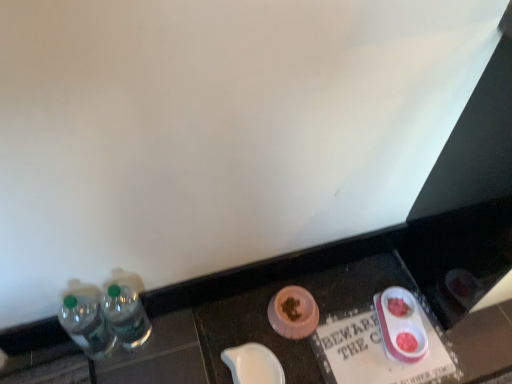
Question: Could you tell me if clear plastic bottles at left, the 2th bottle viewed from the left, is turned towards clear plastic bottles at left?

Choices:
 (A) no
 (B) yes

Answer: (A)

Question: Can you confirm if clear plastic bottles at left, which is counted as the first bottle, starting from the right, is taller than clear plastic bottles at left?

Choices:
 (A) yes
 (B) no

Answer: (A)

Question: Considering the relative sizes of clear plastic bottles at left, the 2th bottle viewed from the left, and clear plastic bottles at left in the image provided, is clear plastic bottles at left, the 2th bottle viewed from the left, wider than clear plastic bottles at left?

Choices:
 (A) yes
 (B) no

Answer: (A)

Question: Are clear plastic bottles at left, which is counted as the first bottle, starting from the right, and clear plastic bottles at left far apart?

Choices:
 (A) yes
 (B) no

Answer: (B)

Question: Is clear plastic bottles at left, the 2th bottle viewed from the left, smaller than clear plastic bottles at left?

Choices:
 (A) no
 (B) yes

Answer: (B)

Question: Which is correct: white paper sign at lower center is inside clear plastic bottles at left, or outside of it?

Choices:
 (A) inside
 (B) outside

Answer: (B)

Question: From a real-world perspective, is white paper sign at lower center positioned above or below clear plastic bottles at left?

Choices:
 (A) below
 (B) above

Answer: (A)

Question: Is point (373, 317) positioned closer to the camera than point (242, 339)?

Choices:
 (A) farther
 (B) closer

Answer: (A)

Question: Based on their positions, is white paper sign at lower center located to the left or right of clear plastic bottles at left?

Choices:
 (A) left
 (B) right

Answer: (B)

Question: Does point (333, 329) appear closer or farther from the camera than point (402, 309)?

Choices:
 (A) farther
 (B) closer

Answer: (B)

Question: Looking at the image, does white paper sign at lower center seem bigger or smaller compared to pink plastic food bowls at lower right, placed as the second tableware when sorted from left to right?

Choices:
 (A) small
 (B) big

Answer: (B)

Question: Is white paper sign at lower center wider or thinner than pink plastic food bowls at lower right, placed as the second tableware when sorted from left to right?

Choices:
 (A) thin
 (B) wide

Answer: (B)

Question: Considering their positions, is white paper sign at lower center located in front of or behind pink plastic food bowls at lower right, placed as the second tableware when sorted from left to right?

Choices:
 (A) behind
 (B) front

Answer: (B)

Question: Is clear plastic bottles at left, the 2th bottle viewed from the left, spatially inside white paper sign at lower center, or outside of it?

Choices:
 (A) inside
 (B) outside

Answer: (B)

Question: Considering the positions of clear plastic bottles at left, which is counted as the first bottle, starting from the right, and white paper sign at lower center in the image, is clear plastic bottles at left, which is counted as the first bottle, starting from the right, bigger or smaller than white paper sign at lower center?

Choices:
 (A) big
 (B) small

Answer: (B)